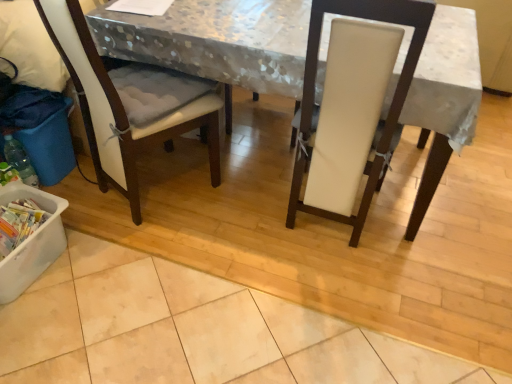
Locate an element on the screen. The height and width of the screenshot is (384, 512). vacant space that is in between white fabric chair at left, the second chair positioned from the right, and white plastic container at lower left, placed as the 2th recycling bin when sorted from top to bottom is located at coordinates (82, 254).